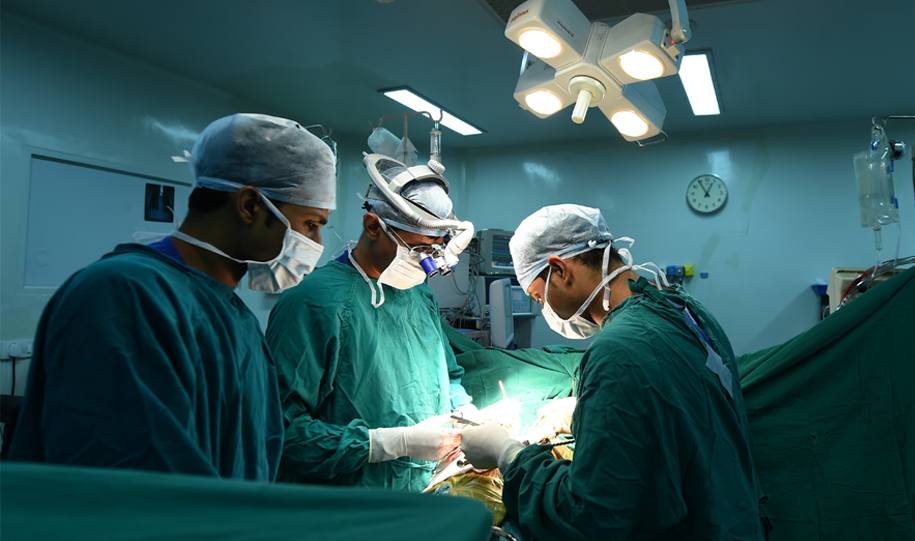
This screenshot has width=915, height=541. In order to click on walls in this screenshot , I will do `click(33, 217)`, `click(770, 257)`, `click(619, 188)`, `click(822, 174)`.